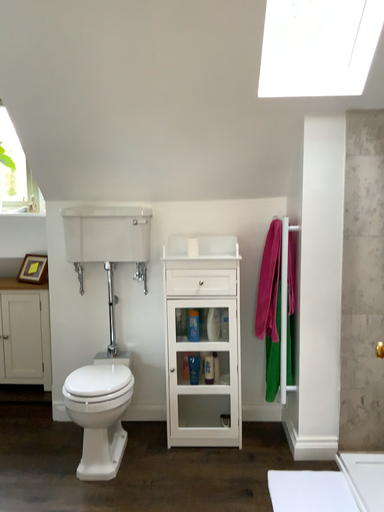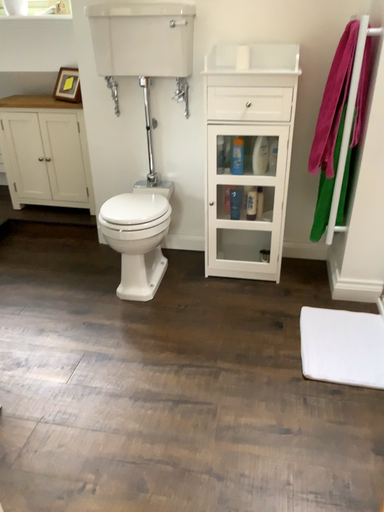
Question: Which way did the camera rotate in the video?

Choices:
 (A) rotated upward
 (B) rotated downward

Answer: (B)